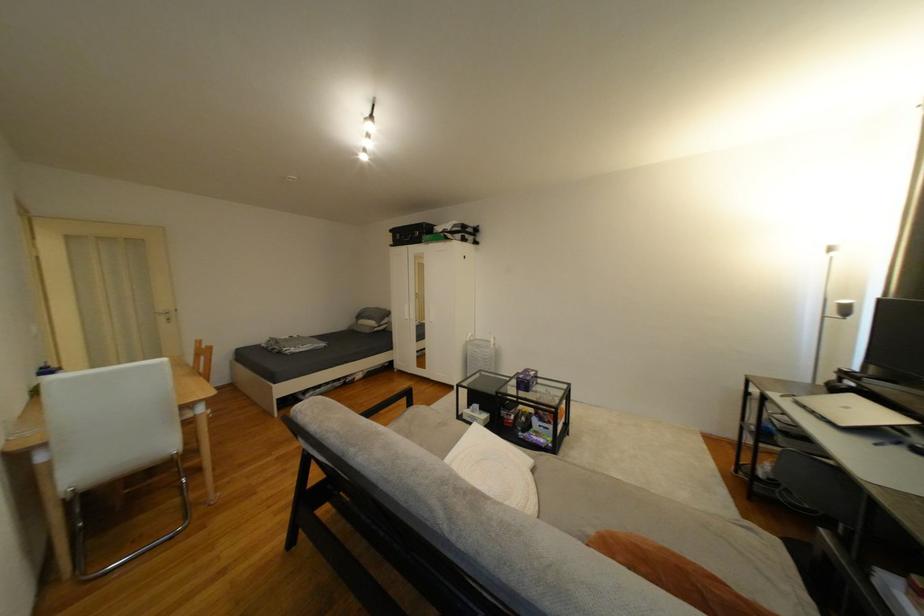
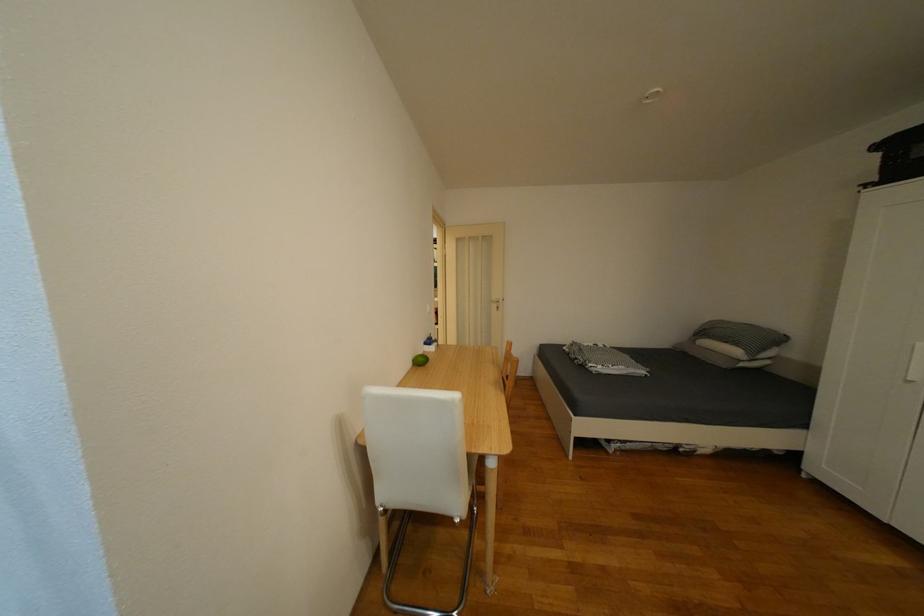
Where in the second image is the point corresponding to point 365,320 from the first image?

(702, 337)